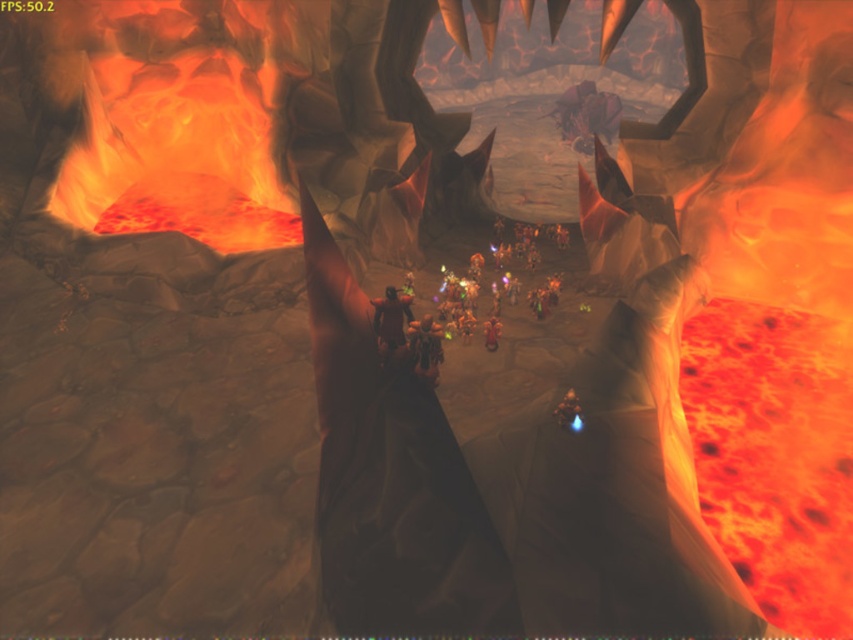
Question: From the image, what is the correct spatial relationship of lava/molten rock fire at left in relation to dark brown leather armor at center?

Choices:
 (A) below
 (B) above

Answer: (B)

Question: Is lava/molten rock fire at left thinner than dark brown leather armor at center?

Choices:
 (A) yes
 (B) no

Answer: (B)

Question: Is lava/molten rock fire at left bigger than dark brown leather armor at center?

Choices:
 (A) no
 (B) yes

Answer: (B)